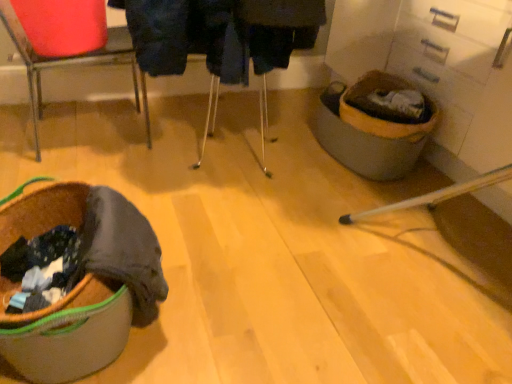
The height and width of the screenshot is (384, 512). Identify the location of metallic red chair at upper left. (67, 45).

What do you see at coordinates (67, 45) in the screenshot? I see `metallic red chair at upper left` at bounding box center [67, 45].

This screenshot has width=512, height=384. Find the location of `brown fabric laundry basket at lower left`. brown fabric laundry basket at lower left is located at coordinates (69, 334).

What do you see at coordinates (69, 334) in the screenshot? Image resolution: width=512 pixels, height=384 pixels. I see `brown fabric laundry basket at lower left` at bounding box center [69, 334].

Where is `metallic red chair at upper left`? metallic red chair at upper left is located at coordinates (67, 45).

Between metallic red chair at upper left and brown fabric laundry basket at lower left, which one appears on the right side from the viewer's perspective?

From the viewer's perspective, brown fabric laundry basket at lower left appears more on the right side.

In the image, is metallic red chair at upper left positioned in front of or behind brown fabric laundry basket at lower left?

In the image, metallic red chair at upper left appears behind brown fabric laundry basket at lower left.

Is point (80, 12) positioned after point (91, 327)?

Yes, point (80, 12) is behind point (91, 327).

From the image's perspective, is metallic red chair at upper left located above or below brown fabric laundry basket at lower left?

From the image's perspective, metallic red chair at upper left appears above brown fabric laundry basket at lower left.

From a real-world perspective, between metallic red chair at upper left and brown fabric laundry basket at lower left, who is vertically lower?

brown fabric laundry basket at lower left, from a real-world perspective.

Does metallic red chair at upper left have a lesser width compared to brown fabric laundry basket at lower left?

Yes.

Considering the sizes of metallic red chair at upper left and brown fabric laundry basket at lower left in the image, is metallic red chair at upper left taller or shorter than brown fabric laundry basket at lower left?

metallic red chair at upper left is taller than brown fabric laundry basket at lower left.

Between metallic red chair at upper left and brown fabric laundry basket at lower left, which one has larger size?

metallic red chair at upper left is bigger.

Is brown fabric laundry basket at lower left located within metallic red chair at upper left?

No, brown fabric laundry basket at lower left is not a part of metallic red chair at upper left.

Are metallic red chair at upper left and brown fabric laundry basket at lower left located far from each other?

No, metallic red chair at upper left is not far from brown fabric laundry basket at lower left.

Looking at this image, could you tell me if metallic red chair at upper left is facing brown fabric laundry basket at lower left?

Yes, metallic red chair at upper left faces towards brown fabric laundry basket at lower left.

Can you tell me how much metallic red chair at upper left and brown fabric laundry basket at lower left differ in facing direction?

They differ by 86.1 degrees in their facing directions.

The image size is (512, 384). What are the coordinates of `laundry basket below the metallic red chair at upper left (from the image's perspective)` in the screenshot? It's located at (69, 334).

From the picture: Which object is positioned more to the right, brown fabric laundry basket at lower left or metallic red chair at upper left?

brown fabric laundry basket at lower left.

In the image, is brown fabric laundry basket at lower left positioned in front of or behind metallic red chair at upper left?

In the image, brown fabric laundry basket at lower left appears in front of metallic red chair at upper left.

Does point (45, 311) appear closer or farther from the camera than point (91, 4)?

Point (45, 311).

From the image's perspective, between brown fabric laundry basket at lower left and metallic red chair at upper left, who is located below?

From the image's view, brown fabric laundry basket at lower left is below.

From a real-world perspective, between brown fabric laundry basket at lower left and metallic red chair at upper left, who is vertically lower?

brown fabric laundry basket at lower left.

Can you confirm if brown fabric laundry basket at lower left is wider than metallic red chair at upper left?

Indeed, brown fabric laundry basket at lower left has a greater width compared to metallic red chair at upper left.

Which of these two, brown fabric laundry basket at lower left or metallic red chair at upper left, stands taller?

With more height is metallic red chair at upper left.

Considering the relative sizes of brown fabric laundry basket at lower left and metallic red chair at upper left in the image provided, is brown fabric laundry basket at lower left smaller than metallic red chair at upper left?

Indeed, brown fabric laundry basket at lower left has a smaller size compared to metallic red chair at upper left.

Is metallic red chair at upper left located within brown fabric laundry basket at lower left?

No, metallic red chair at upper left is not inside brown fabric laundry basket at lower left.

Is brown fabric laundry basket at lower left touching metallic red chair at upper left?

No, brown fabric laundry basket at lower left is not with metallic red chair at upper left.

Could you tell me if brown fabric laundry basket at lower left is facing metallic red chair at upper left?

No.

How many degrees apart are the facing directions of brown fabric laundry basket at lower left and metallic red chair at upper left?

brown fabric laundry basket at lower left and metallic red chair at upper left are facing 86.1 degrees away from each other.

The width and height of the screenshot is (512, 384). What are the coordinates of `chair above the brown fabric laundry basket at lower left (from the image's perspective)` in the screenshot? It's located at pos(67,45).

At what (x,y) coordinates should I click in order to perform the action: click on chair above the brown fabric laundry basket at lower left (from a real-world perspective). Please return your answer as a coordinate pair (x, y). Looking at the image, I should click on (67, 45).

The image size is (512, 384). I want to click on chair above the brown fabric laundry basket at lower left (from the image's perspective), so click(67, 45).